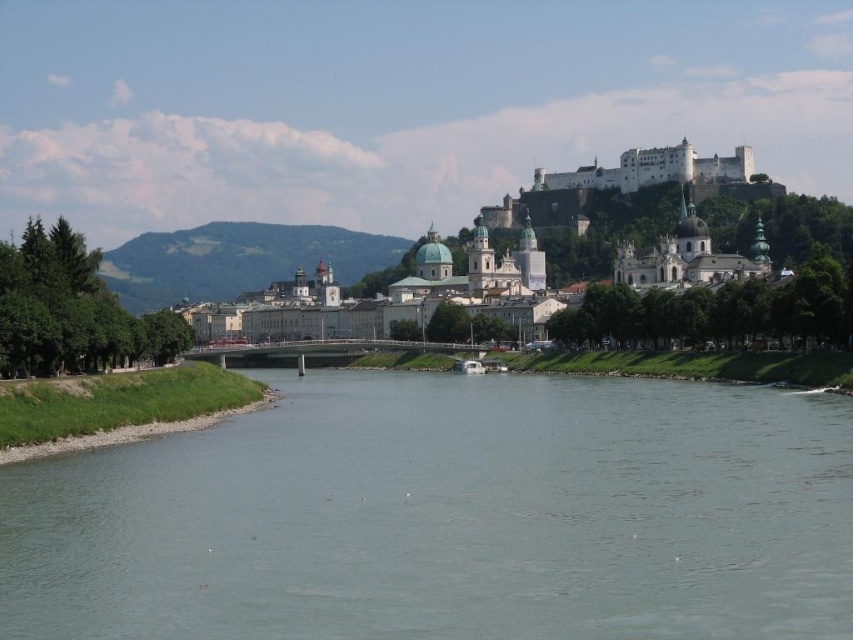
Who is higher up, white stone church at center or white plastic boat at center?

white stone church at center is higher up.

Which is below, white stone church at center or white plastic boat at center?

white plastic boat at center is below.

Where is `white stone church at center`? white stone church at center is located at coordinates (689, 257).

Locate an element on the screen. The height and width of the screenshot is (640, 853). white stone church at center is located at coordinates (689, 257).

Is point (518, 458) positioned after point (297, 257)?

That is False.

Which is below, clear water at center or green grassy hill at center?

clear water at center is below.

What do you see at coordinates (447, 516) in the screenshot? This screenshot has height=640, width=853. I see `clear water at center` at bounding box center [447, 516].

The image size is (853, 640). Identify the location of clear water at center. coord(447,516).

Can you confirm if clear water at center is positioned to the right of white stone church at center?

No, clear water at center is not to the right of white stone church at center.

Measure the distance between point (799,536) and camera.

A distance of 62.07 meters exists between point (799,536) and camera.

Who is more distant from viewer, (x=779, y=513) or (x=728, y=257)?

The point (x=728, y=257) is behind.

Find the location of a particular element. clear water at center is located at coordinates (447, 516).